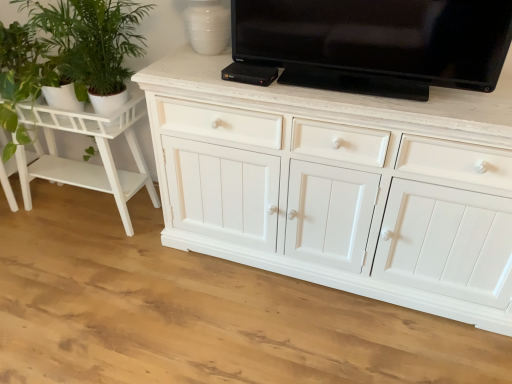
Question: Considering the relative positions of white painted wood side table at left and green leafy plant at left in the image provided, is white painted wood side table at left to the left or to the right of green leafy plant at left?

Choices:
 (A) right
 (B) left

Answer: (B)

Question: Is white painted wood side table at left wider or thinner than green leafy plant at left?

Choices:
 (A) thin
 (B) wide

Answer: (A)

Question: Which of these objects is positioned closest to the white painted wood side table at left?

Choices:
 (A) green leafy plant at left
 (B) black glossy tv at upper center

Answer: (A)

Question: Considering the real-world distances, which object is farthest from the white painted wood side table at left?

Choices:
 (A) green leafy plant at left
 (B) black glossy tv at upper center

Answer: (B)